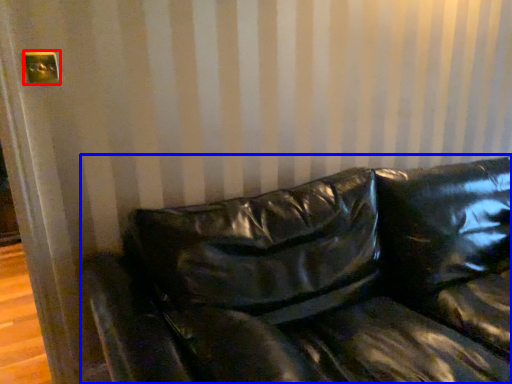
Question: Which of the following is the farthest to the observer, electric outlet (highlighted by a red box) or studio couch (highlighted by a blue box)?

Choices:
 (A) electric outlet
 (B) studio couch

Answer: (A)